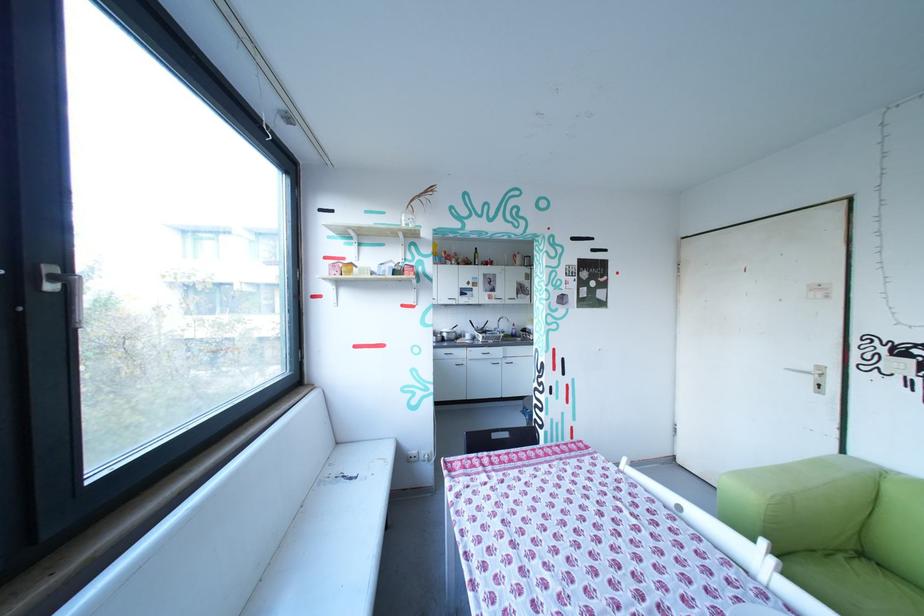
This screenshot has height=616, width=924. Find the location of `sofa sitting surface`. sofa sitting surface is located at coordinates (854, 584).